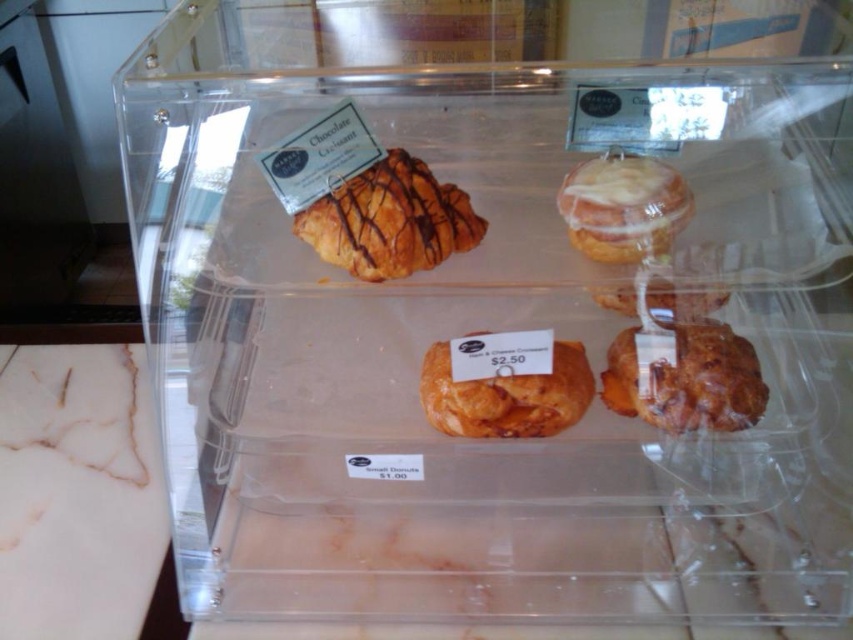
Question: Does golden flaky croissant at upper left appear over glossy brown croissant at center?

Choices:
 (A) no
 (B) yes

Answer: (B)

Question: Can you confirm if golden flaky croissant at upper left is thinner than white glazed donut at upper center?

Choices:
 (A) yes
 (B) no

Answer: (B)

Question: Among these objects, which one is nearest to the camera?

Choices:
 (A) white glazed donut at upper center
 (B) glossy brown croissant at center

Answer: (A)

Question: Which of these objects is positioned farthest from the white glazed donut at upper center?

Choices:
 (A) golden flaky croissant at center
 (B) golden flaky croissant at upper left
 (C) glossy brown croissant at center

Answer: (A)

Question: Which point appears closest to the camera in this image?

Choices:
 (A) (741, 339)
 (B) (387, 260)
 (C) (561, 424)

Answer: (B)

Question: Where is golden flaky croissant at upper left located in relation to golden flaky croissant at center in the image?

Choices:
 (A) below
 (B) above

Answer: (B)